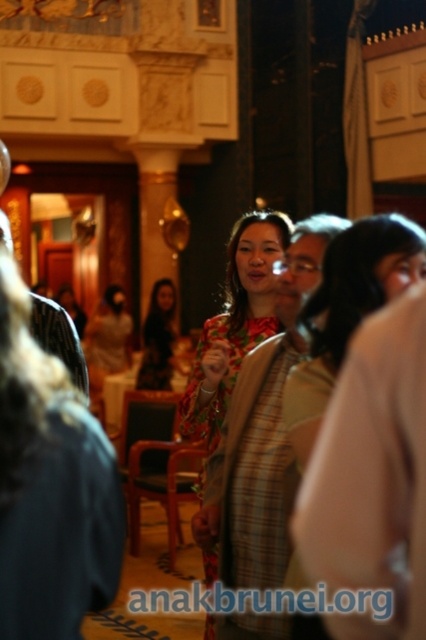
Identify the location of plaid fabric shirt at center. (262, 433).

Who is more distant from viewer, (x=213, y=538) or (x=336, y=369)?

The point (x=213, y=538) is behind.

I want to click on plaid fabric shirt at center, so click(262, 433).

Is floral dress at center closer to camera compared to matte floral dress at center?

Yes, it is.

Is point (354, 253) in front of point (172, 288)?

Yes, point (354, 253) is closer to viewer.

Locate an element on the screen. The width and height of the screenshot is (426, 640). floral dress at center is located at coordinates (347, 310).

Consider the image. Measure the distance between plaid fabric shirt at center and matte floral dress at center.

They are 19.98 meters apart.

Which is below, plaid fabric shirt at center or matte floral dress at center?

matte floral dress at center is lower down.

Describe the element at coordinates (262, 433) in the screenshot. I see `plaid fabric shirt at center` at that location.

At what (x,y) coordinates should I click in order to perform the action: click on plaid fabric shirt at center. Please return your answer as a coordinate pair (x, y). This screenshot has width=426, height=640. Looking at the image, I should click on (262, 433).